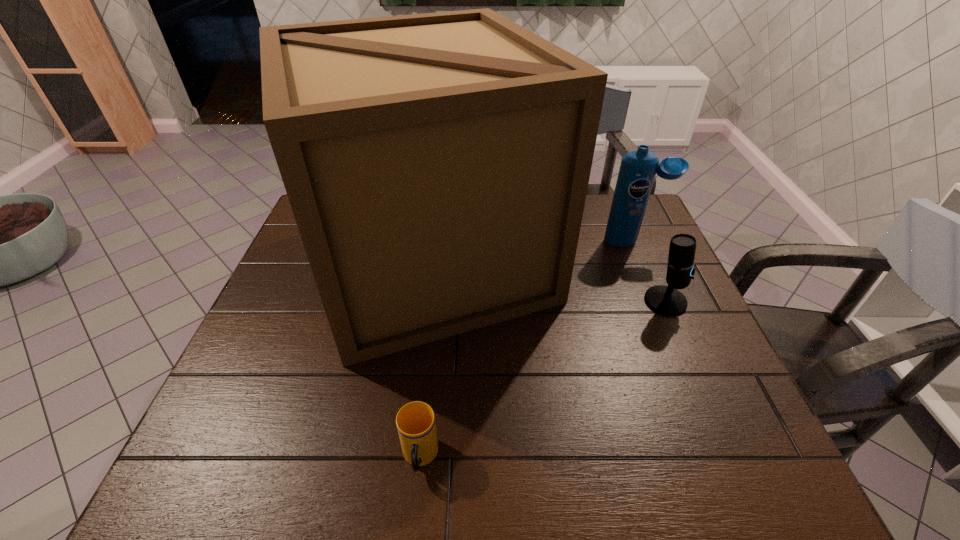
Where is `object located in the near edge section of the desktop`? This screenshot has height=540, width=960. object located in the near edge section of the desktop is located at coordinates (415, 421).

Where is `object positioned at the left edge`? The image size is (960, 540). object positioned at the left edge is located at coordinates (437, 165).

Where is `shampoo that is at the right edge`? This screenshot has width=960, height=540. shampoo that is at the right edge is located at coordinates (637, 171).

This screenshot has height=540, width=960. Identify the location of microphone at the right edge. (667, 300).

The image size is (960, 540). Find the location of `object present at the far left corner`. object present at the far left corner is located at coordinates (437, 165).

Image resolution: width=960 pixels, height=540 pixels. What are the coordinates of `object situated at the far right corner` in the screenshot? It's located at (637, 171).

In the image, there is a desktop. At what (x,y) coordinates should I click in order to perform the action: click on vacant region at the near edge. Please return your answer as a coordinate pair (x, y). Looking at the image, I should click on click(x=636, y=462).

I want to click on free region at the left edge, so click(296, 254).

Locate an element on the screen. This screenshot has width=960, height=540. free space at the right edge of the desktop is located at coordinates (702, 359).

Find the location of a particular element. vacant space at the near right corner is located at coordinates pyautogui.click(x=727, y=484).